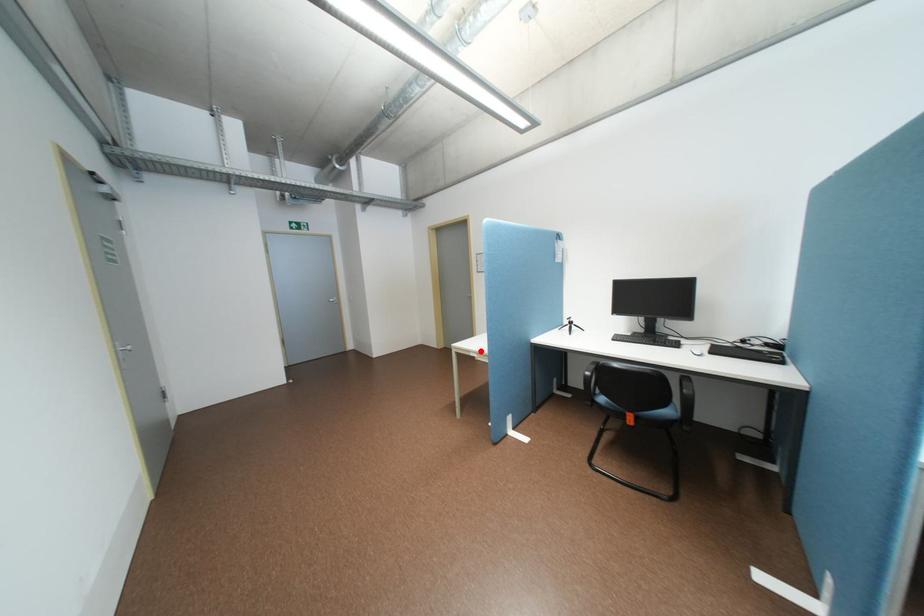
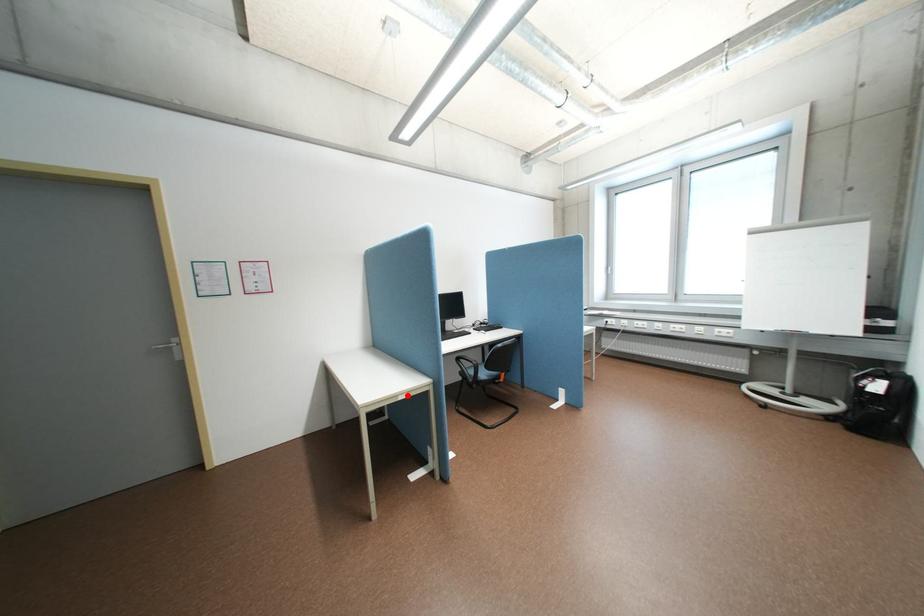
I am providing you with two images of the same scene from different viewpoints. A red point is marked on the first image and another point is marked on the second image. Does the point marked in image1 correspond to the same location as the one in image2?

Yes